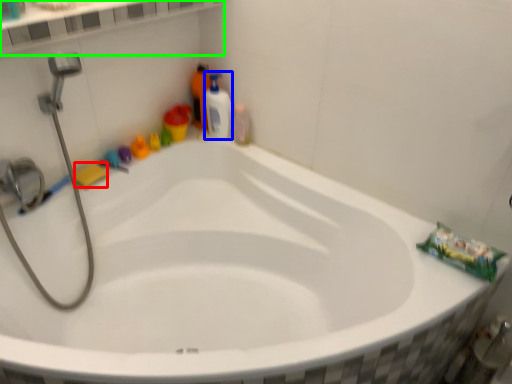
Question: Considering the real-world distances, which object is closest to soap (highlighted by a red box)? cleaning product (highlighted by a blue box) or ledge (highlighted by a green box).

Choices:
 (A) cleaning product
 (B) ledge

Answer: (A)